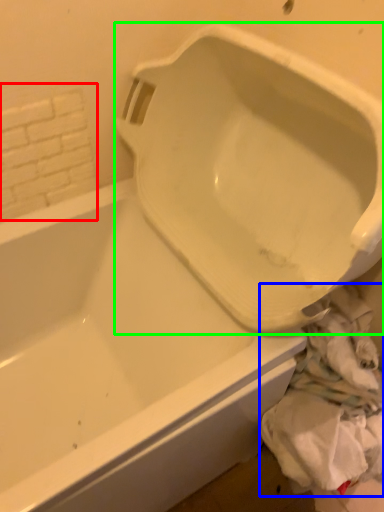
Question: Which is nearer to the tile (highlighted by a red box)? material (highlighted by a blue box) or urinal (highlighted by a green box).

Choices:
 (A) material
 (B) urinal

Answer: (B)